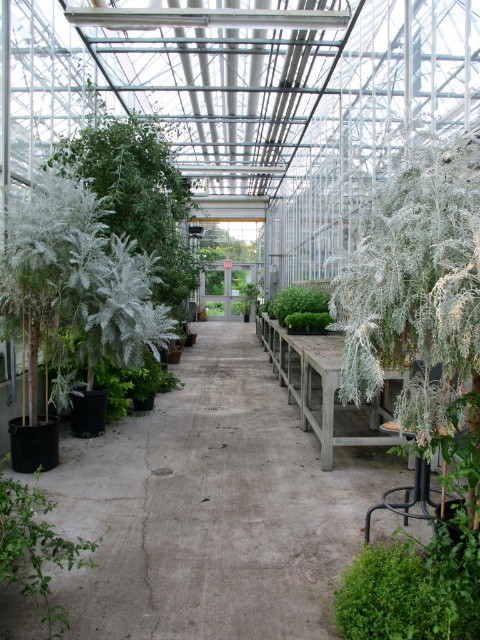
Question: Is silvery-white feathery plant at right bigger than silvery-green foliage at left?

Choices:
 (A) no
 (B) yes

Answer: (A)

Question: Does silvery-green foliage at left appear under green fuzzy plant at left?

Choices:
 (A) yes
 (B) no

Answer: (A)

Question: Which of the following is the farthest from the observer?

Choices:
 (A) (67, 317)
 (B) (16, 486)
 (C) (310, 301)

Answer: (C)

Question: Which point is closer to the camera?

Choices:
 (A) green fuzzy plant at center
 (B) green fuzzy plant at left
 (C) silvery-white feathery plant at right
 (D) green matte plant at lower left

Answer: (C)

Question: Can you confirm if silvery-white feathery plant at right is positioned to the right of green fuzzy plant at center?

Choices:
 (A) no
 (B) yes

Answer: (A)

Question: Estimate the real-world distances between objects in this image. Which object is closer to the silvery-white feathery plant at right?

Choices:
 (A) green fuzzy plant at center
 (B) silvery-green foliage at left
 (C) green matte plant at lower left

Answer: (C)